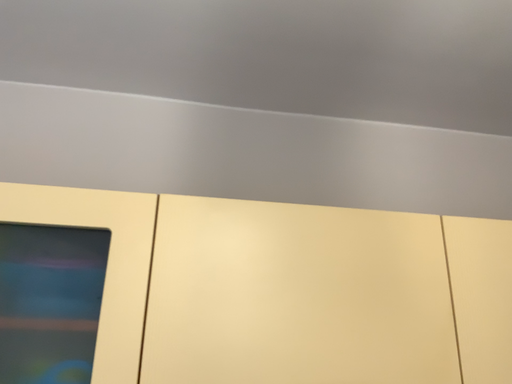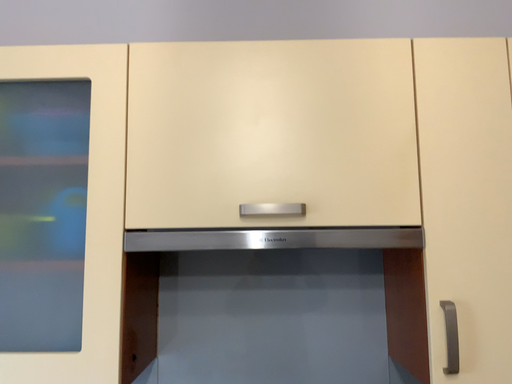
Question: Which way did the camera rotate in the video?

Choices:
 (A) rotated downward
 (B) rotated upward

Answer: (A)